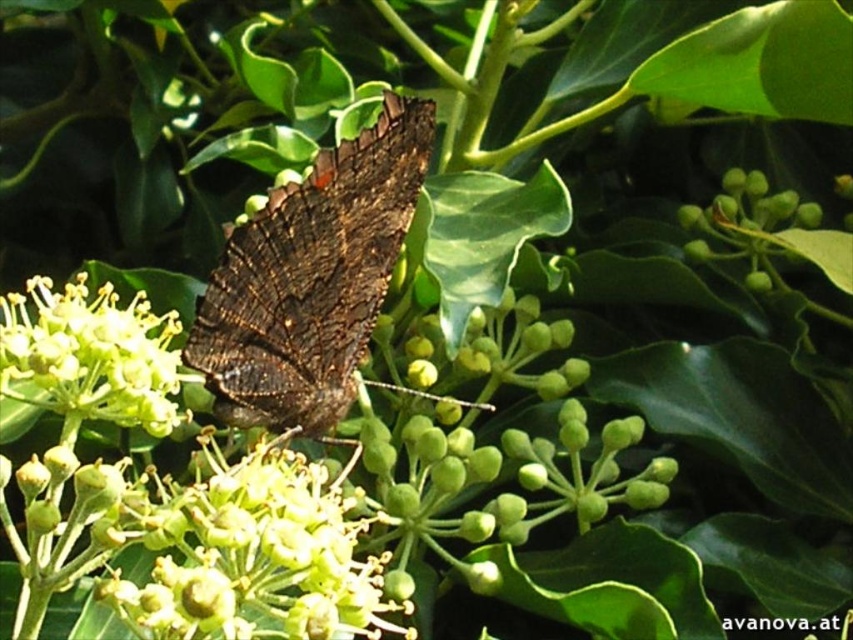
Question: Among these points, which one is nearest to the camera?

Choices:
 (A) (363, 225)
 (B) (258, 579)

Answer: (B)

Question: Among these points, which one is farthest from the camera?

Choices:
 (A) [x=67, y=403]
 (B) [x=370, y=588]
 (C) [x=311, y=435]

Answer: (C)

Question: Which of the following is the closest to the observer?

Choices:
 (A) yellow-green textured flower at center
 (B) dark brown textured butterfly at center
 (C) yellow-green textured flower at center-left

Answer: (A)

Question: From the image, what is the correct spatial relationship of dark brown textured butterfly at center in relation to yellow-green textured flower at center?

Choices:
 (A) left
 (B) right

Answer: (B)

Question: Does dark brown textured butterfly at center have a smaller size compared to yellow-green textured flower at center?

Choices:
 (A) yes
 (B) no

Answer: (A)

Question: Is yellow-green textured flower at center below yellow-green textured flower at center-left?

Choices:
 (A) yes
 (B) no

Answer: (A)